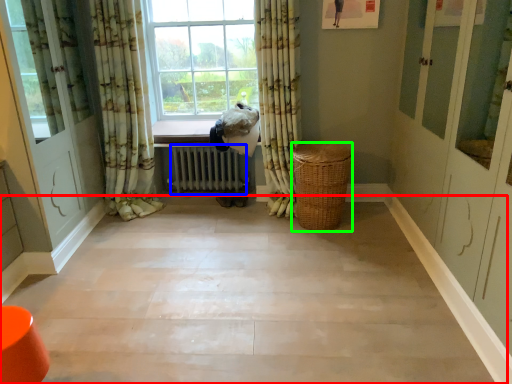
Question: Based on their relative distances, which object is farther from corridor (highlighted by a red box)? Choose from radiator (highlighted by a blue box) and basket (highlighted by a green box).

Choices:
 (A) radiator
 (B) basket

Answer: (A)